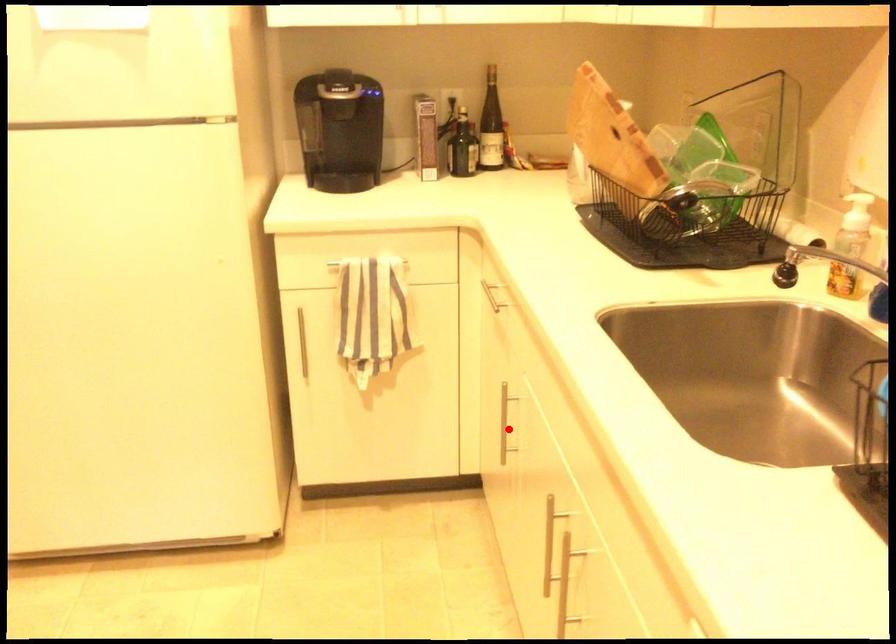
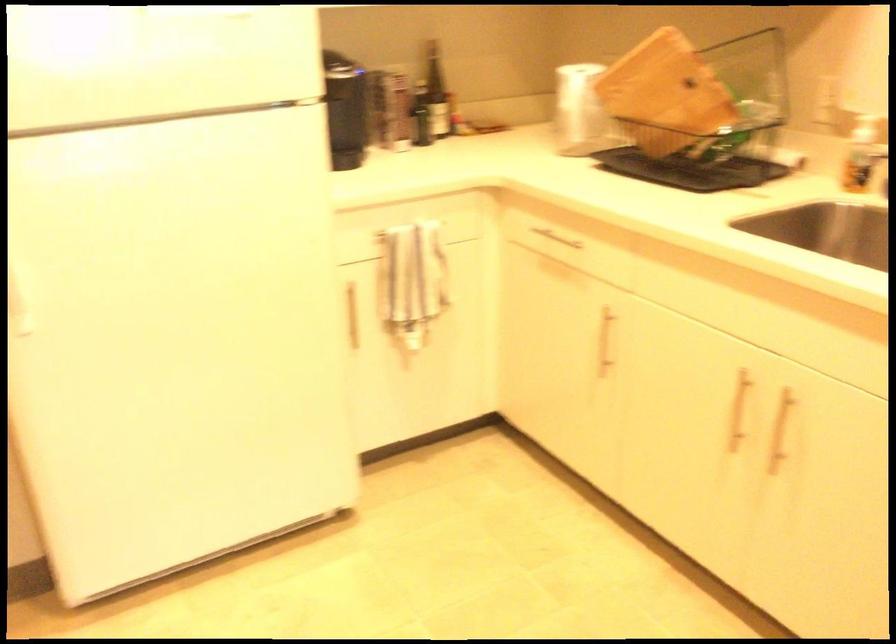
Question: I am providing you with two images of the same scene from different viewpoints. A red point is shown in image1. For the corresponding object point in image2, is it positioned nearer or farther from the camera?

Choices:
 (A) Nearer
 (B) Farther

Answer: (B)